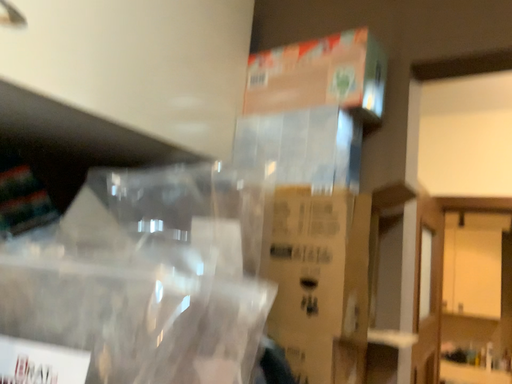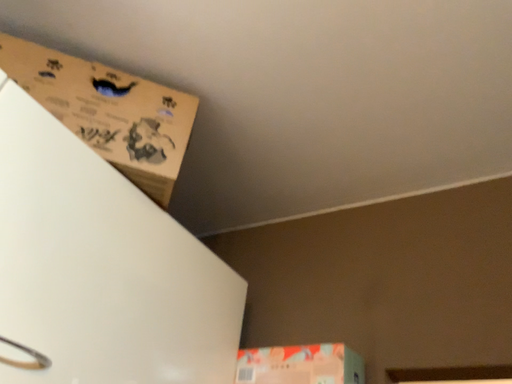
Question: Which way did the camera rotate in the video?

Choices:
 (A) rotated upward
 (B) rotated downward

Answer: (A)